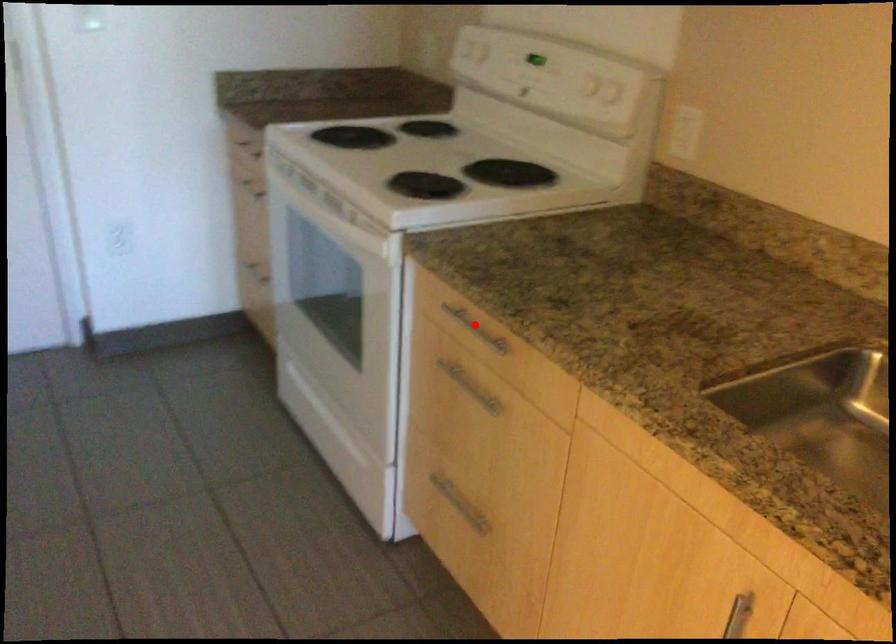
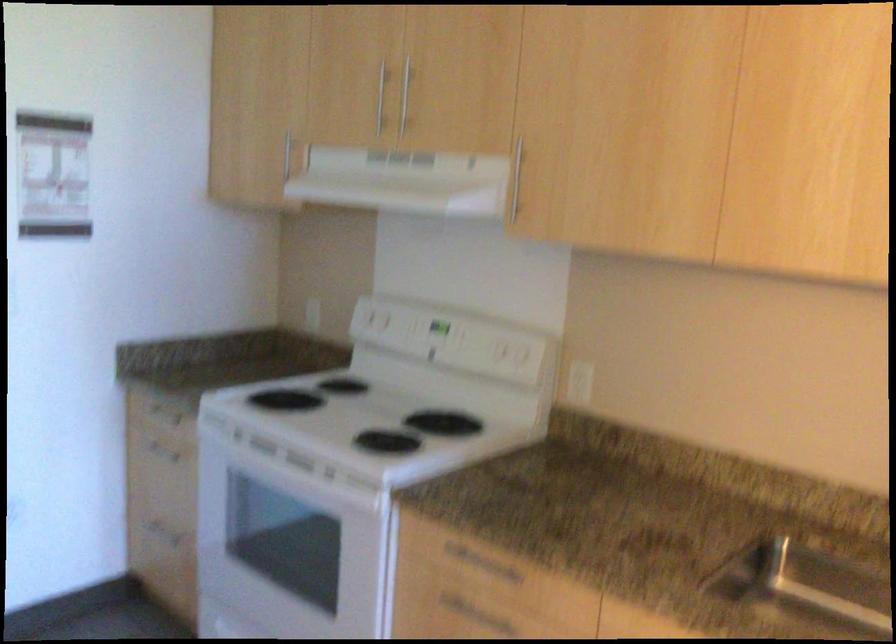
Find the pixel in the second image that matches the highlighted location in the first image.

(480, 564)